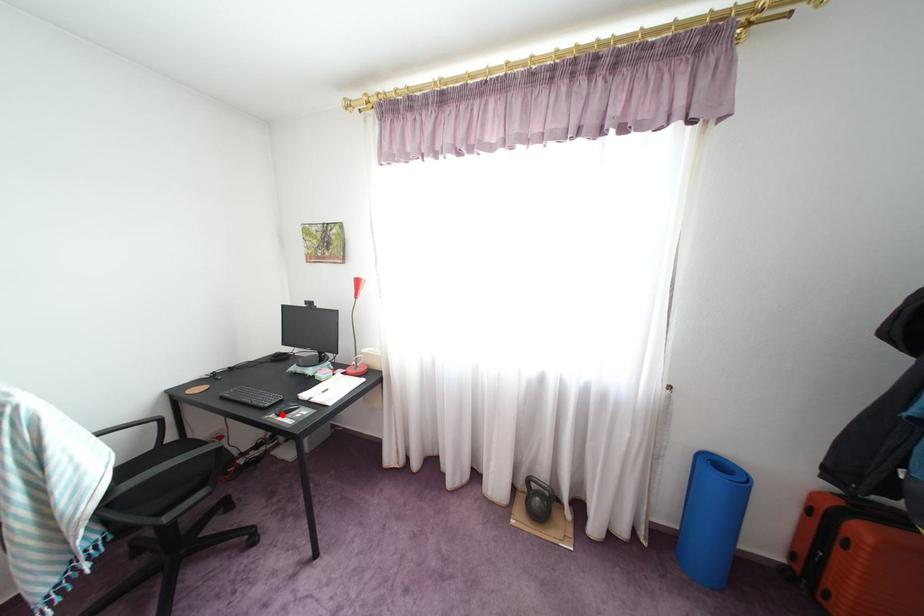
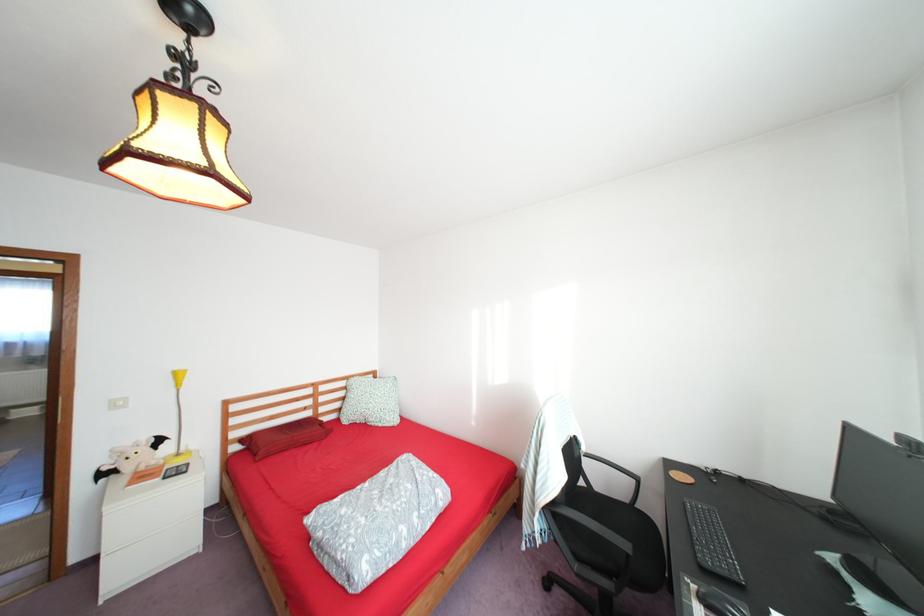
Where in the second image is the point corresponding to the highlighted location from the first image?

(706, 586)